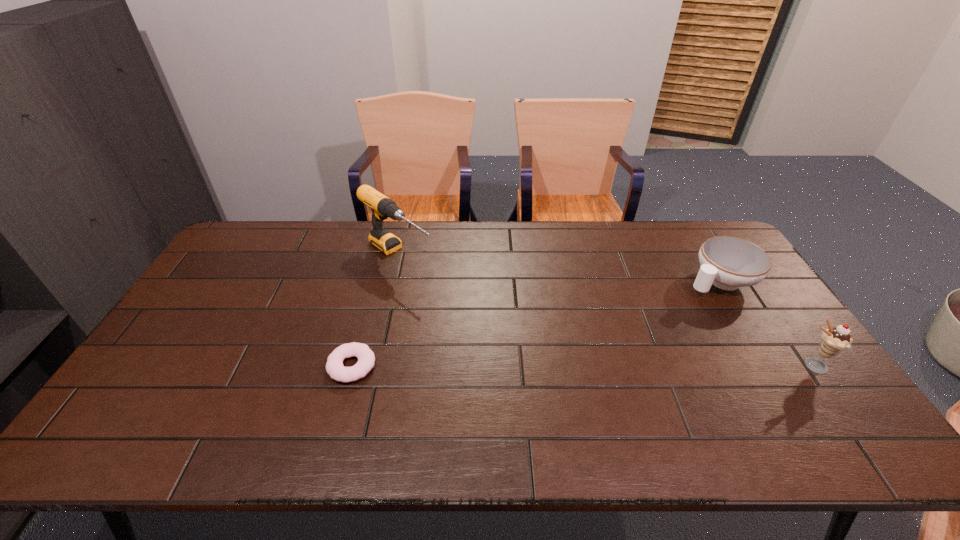
Where is `free space at the left edge of the desktop`? free space at the left edge of the desktop is located at coordinates [x=158, y=363].

In the image, there is a desktop. Where is `vacant region at the right edge`? Image resolution: width=960 pixels, height=540 pixels. vacant region at the right edge is located at coordinates (777, 328).

The image size is (960, 540). Identify the location of vacant area at the far left corner. (273, 226).

Image resolution: width=960 pixels, height=540 pixels. In order to click on vacant area at the far right corner in this screenshot , I will do pos(677,224).

This screenshot has height=540, width=960. In order to click on vacant space at the near right corner of the desktop in this screenshot , I will do `click(829, 402)`.

I want to click on vacant space that's between the third tallest object and the drill, so click(559, 267).

Locate an element on the screen. unoccupied area between the chinaware and the doughnut is located at coordinates (536, 323).

You are a GUI agent. You are given a task and a screenshot of the screen. Output one action in this format:
    pyautogui.click(x=<x>, y=<y>)
    Task: Click on the free spot between the second shortest object and the shortest object
    
    Given the screenshot: What is the action you would take?
    pyautogui.click(x=536, y=323)

The height and width of the screenshot is (540, 960). What are the coordinates of `vacant space in between the chinaware and the second tallest object` in the screenshot? It's located at (765, 323).

Where is `empty space between the shortest object and the third shortest object`? empty space between the shortest object and the third shortest object is located at coordinates (582, 366).